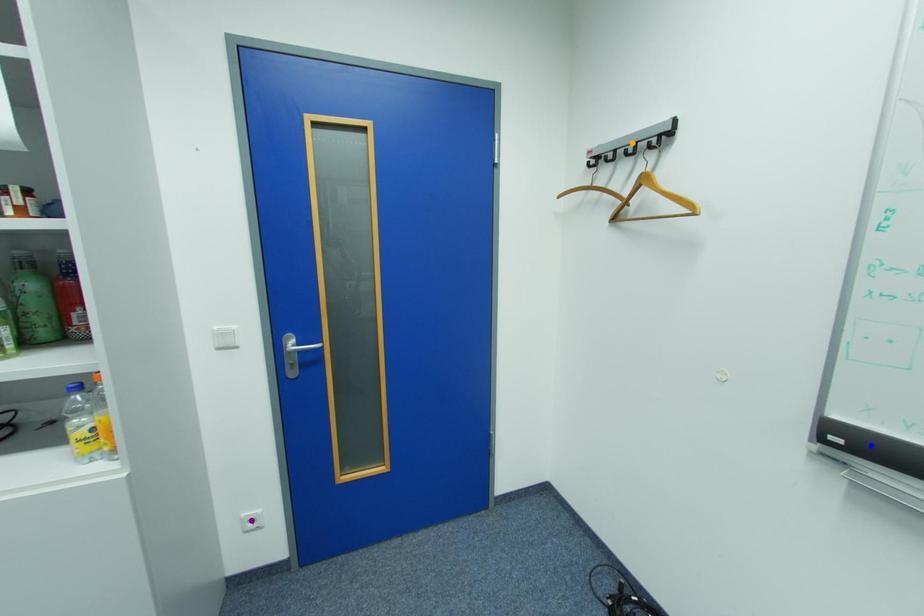
Order these from nearest to farthest:
1. blue point
2. orange point
3. purple point

blue point < orange point < purple point